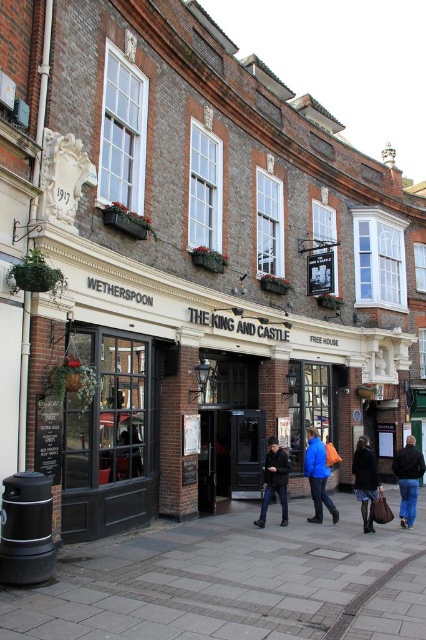
Question: Does gray concrete pavement at lower center have a larger size compared to denim jacket at lower right?

Choices:
 (A) yes
 (B) no

Answer: (A)

Question: Where is dark blue fabric coat at center located in relation to dark blue leather jacket at center in the image?

Choices:
 (A) right
 (B) left

Answer: (A)

Question: Which object is the closest to the dark blue leather jacket at center?

Choices:
 (A) blue fabric jacket at center
 (B) denim jacket at lower right
 (C) dark blue fabric coat at center

Answer: (A)

Question: Is dark blue fabric coat at center further to camera compared to dark blue leather jacket at center?

Choices:
 (A) yes
 (B) no

Answer: (B)

Question: Which object appears closest to the camera in this image?

Choices:
 (A) dark blue leather jacket at center
 (B) dark blue fabric coat at center
 (C) blue fabric jacket at center

Answer: (B)

Question: Which point appears farthest from the camera in this image?

Choices:
 (A) pyautogui.click(x=379, y=486)
 (B) pyautogui.click(x=284, y=458)
 (C) pyautogui.click(x=402, y=500)
 (D) pyautogui.click(x=319, y=496)

Answer: (C)